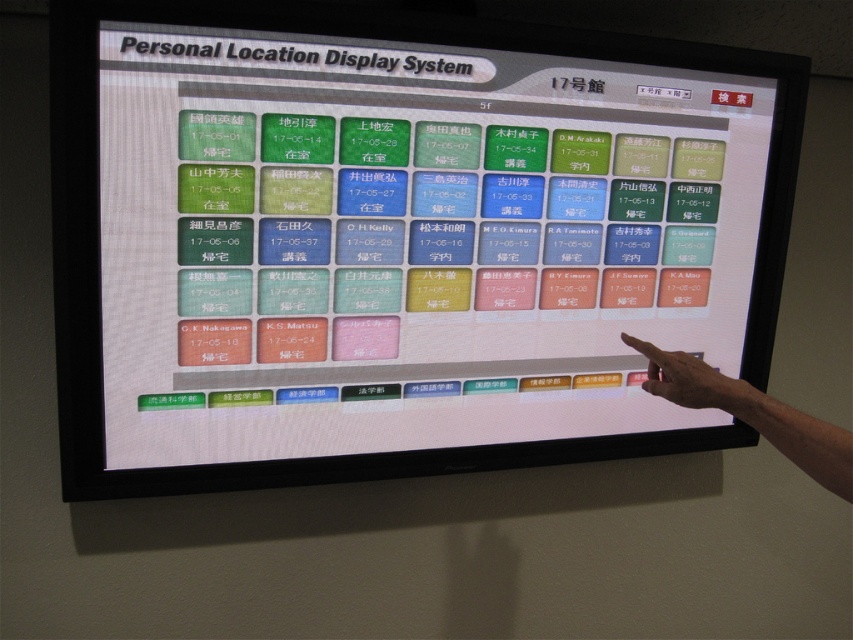
Is skin tone finger at upper right below skin-toned flesh at lower right?

Yes.

I want to click on skin tone finger at upper right, so click(752, 413).

Locate an element on the screen. skin tone finger at upper right is located at coordinates (752, 413).

Which is above, white glossy monitor at center or skin tone finger at upper right?

Positioned higher is white glossy monitor at center.

From the picture: Between white glossy monitor at center and skin tone finger at upper right, which one appears on the right side from the viewer's perspective?

From the viewer's perspective, skin tone finger at upper right appears more on the right side.

Between point (370, 378) and point (688, 390), which one is positioned in front?

Point (688, 390) is in front.

Identify the location of white glossy monitor at center. The image size is (853, 640). point(396,240).

Between point (589, 193) and point (722, 397), which one is positioned in front?

Point (722, 397) is more forward.

In order to click on white glossy monitor at center in this screenshot , I will do `click(396, 240)`.

Who is more distant from viewer, (299, 236) or (724, 410)?

Positioned behind is point (299, 236).

What are the coordinates of `white glossy monitor at center` in the screenshot? It's located at (396, 240).